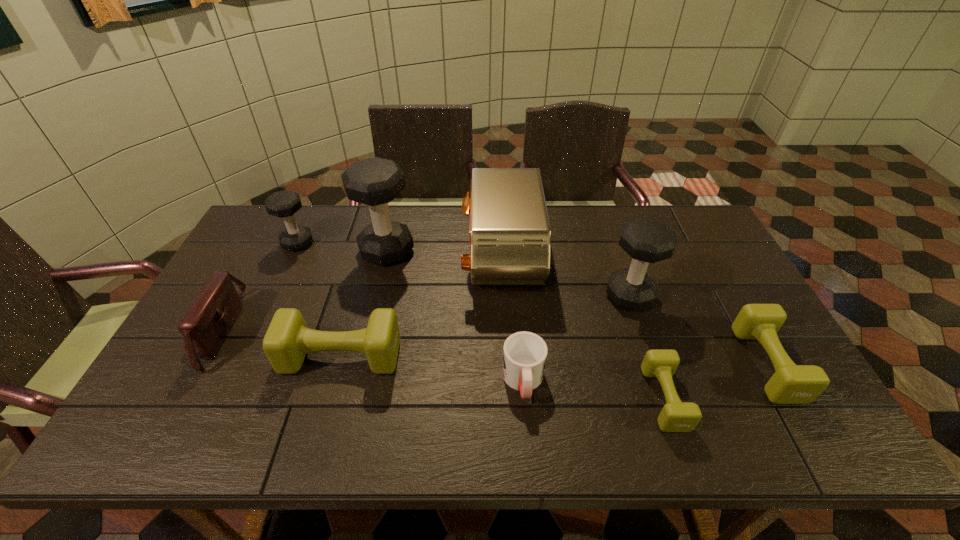
Where is `vacant point located 0.190m on the front of the second object from left to right`? vacant point located 0.190m on the front of the second object from left to right is located at coordinates (273, 296).

The height and width of the screenshot is (540, 960). I want to click on blank space located 0.260m on the front flap of the leftmost object, so click(329, 331).

Locate an element on the screen. vacant space positioned 0.400m on the back of the leftmost olive dumbbell is located at coordinates (372, 243).

Where is `vacant space situated on the side of the mug with the handle`? The image size is (960, 540). vacant space situated on the side of the mug with the handle is located at coordinates (528, 444).

I want to click on free region located on the left of the rightmost olive dumbbell, so click(x=708, y=364).

Where is `free point located 0.250m on the right of the smallest olive dumbbell`? This screenshot has width=960, height=540. free point located 0.250m on the right of the smallest olive dumbbell is located at coordinates (784, 398).

I want to click on toaster oven located at the far edge, so click(x=510, y=235).

This screenshot has width=960, height=540. Find the location of `object located in the near edge section of the desktop`. object located in the near edge section of the desktop is located at coordinates (676, 416).

Find the location of a particular element. This screenshot has width=960, height=540. dumbbell that is at the left edge is located at coordinates (283, 204).

Locate an element on the screen. shoulder bag present at the left edge is located at coordinates (204, 327).